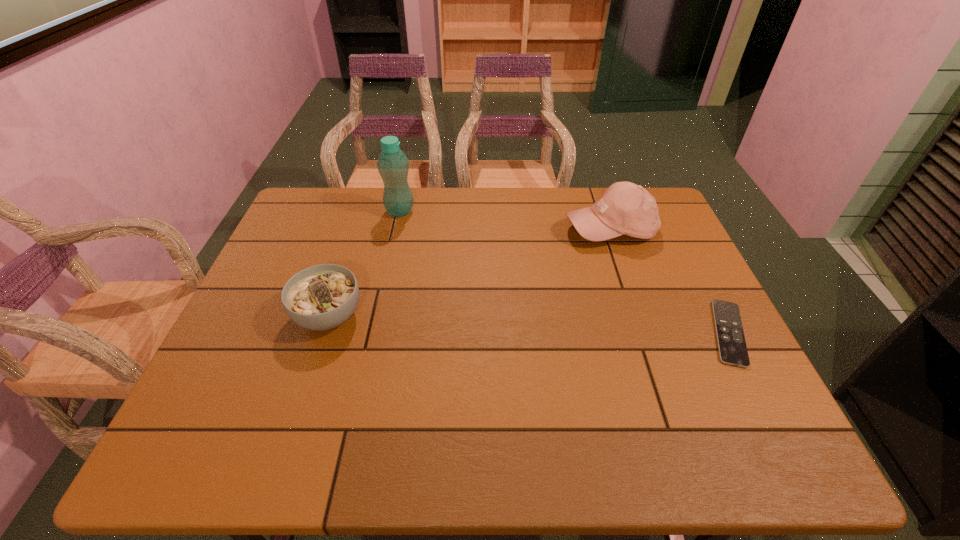
Locate an element on the screen. Image resolution: width=960 pixels, height=540 pixels. the second shortest object is located at coordinates (321, 297).

Image resolution: width=960 pixels, height=540 pixels. Find the location of `the rightmost object`. the rightmost object is located at coordinates (732, 347).

This screenshot has height=540, width=960. Identify the location of the shortest object. (732, 347).

Locate an element on the screen. This screenshot has width=960, height=540. the third object from left to right is located at coordinates (625, 208).

This screenshot has width=960, height=540. Find the location of `the second tallest object`. the second tallest object is located at coordinates (625, 208).

Find the location of a particular element. This screenshot has height=540, width=960. the tallest object is located at coordinates (393, 165).

You are a GUI agent. You are given a task and a screenshot of the screen. Output one action in this format:
    pyautogui.click(x=<x>, y=<y>)
    Task: Click on the free space located on the right of the third tallest object
    
    Given the screenshot: What is the action you would take?
    pyautogui.click(x=399, y=316)

Image resolution: width=960 pixels, height=540 pixels. In order to click on free space located 0.140m on the left of the shortest object in this screenshot , I will do `click(649, 333)`.

This screenshot has width=960, height=540. What are the coordinates of `vacant space located on the front-facing side of the second tallest object` in the screenshot? It's located at (580, 321).

Image resolution: width=960 pixels, height=540 pixels. Find the location of `blank space located on the front-facing side of the second tallest object`. blank space located on the front-facing side of the second tallest object is located at coordinates (590, 282).